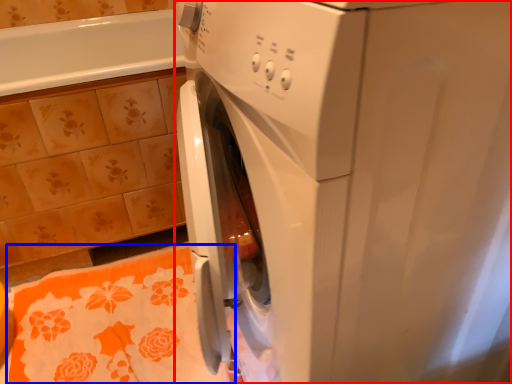
Question: Which object is further to the camera taking this photo, washing machine (highlighted by a red box) or bath towel (highlighted by a blue box)?

Choices:
 (A) washing machine
 (B) bath towel

Answer: (B)